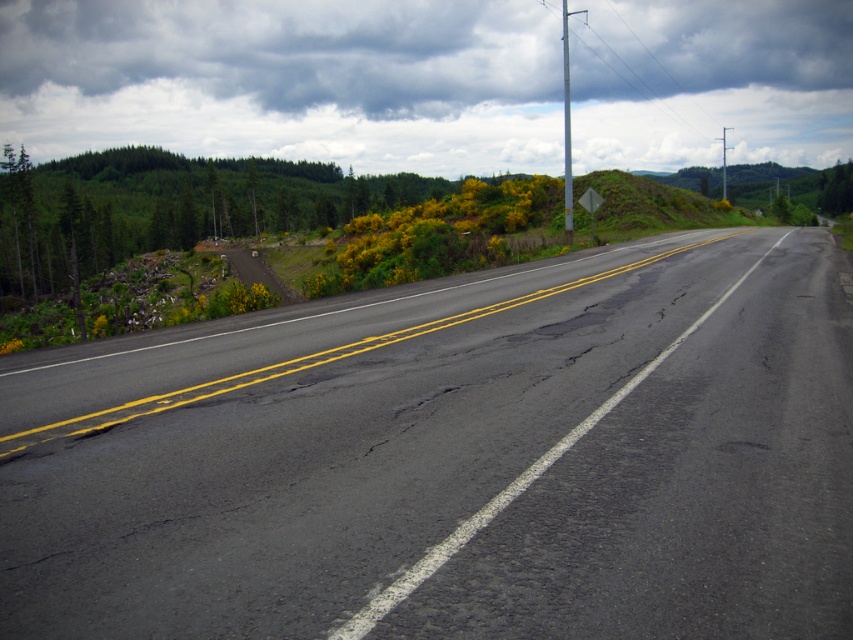
Question: Which of the following is the closest to the observer?

Choices:
 (A) (730, 42)
 (B) (436, 413)

Answer: (B)

Question: Is black asphalt road at center below cloudy sky at upper center?

Choices:
 (A) no
 (B) yes

Answer: (B)

Question: Can you confirm if black asphalt road at center is smaller than cloudy sky at upper center?

Choices:
 (A) yes
 (B) no

Answer: (A)

Question: Which point is closer to the camera?

Choices:
 (A) cloudy sky at upper center
 (B) black asphalt road at center

Answer: (B)

Question: Is black asphalt road at center positioned in front of cloudy sky at upper center?

Choices:
 (A) yes
 (B) no

Answer: (A)